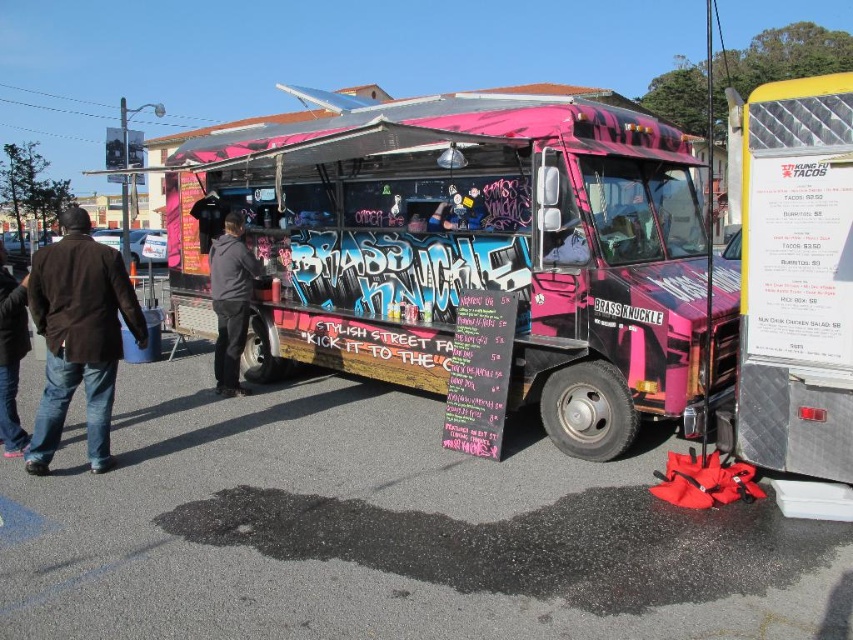
Question: Is black matte jacket at center closer to camera compared to jeans at left?

Choices:
 (A) no
 (B) yes

Answer: (A)

Question: Which object is the closest to the pink matte food truck at center?

Choices:
 (A) brown leather jacket at left
 (B) black matte jacket at center

Answer: (B)

Question: Which point is closer to the camera taking this photo?

Choices:
 (A) (242, 308)
 (B) (409, 138)

Answer: (B)

Question: Which of these objects is positioned closest to the black matte jacket at center?

Choices:
 (A) pink matte food truck at center
 (B) jeans at left

Answer: (A)

Question: Is black matte jacket at center thinner than jeans at left?

Choices:
 (A) no
 (B) yes

Answer: (B)

Question: Is brown leather jacket at left below jeans at left?

Choices:
 (A) no
 (B) yes

Answer: (B)